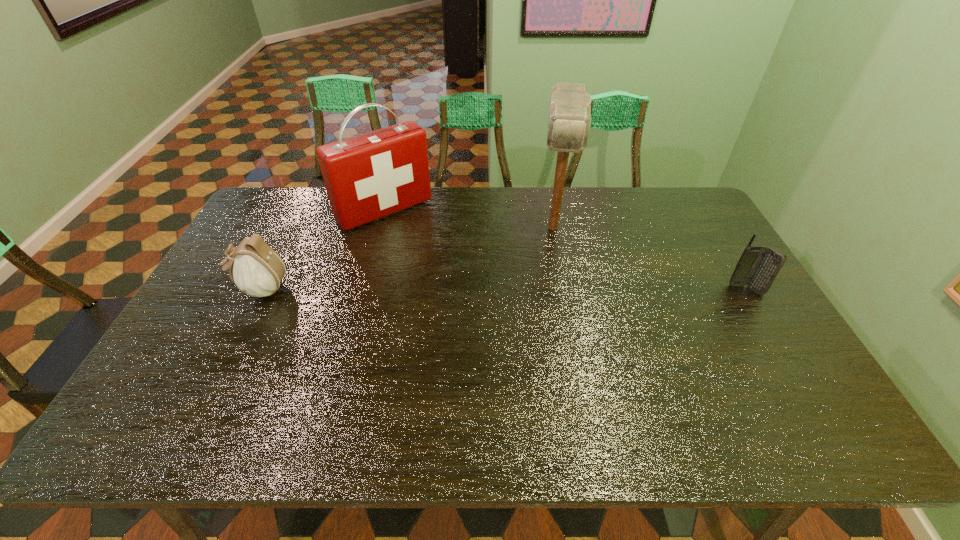
Identify the location of empty space between the first-aid kit and the cellular telephone. (565, 250).

Locate an element on the screen. The height and width of the screenshot is (540, 960). blank region between the rightmost object and the third object from left to right is located at coordinates (649, 259).

Identify which object is the third closest to the leftmost object. Please provide its 2D coordinates. Your answer should be formatted as a tuple, i.e. [(x, y)], where the tuple contains the x and y coordinates of a point satisfying the conditions above.

[(757, 267)]

Point out which object is positioned as the nearest to the rightmost object. Please provide its 2D coordinates. Your answer should be formatted as a tuple, i.e. [(x, y)], where the tuple contains the x and y coordinates of a point satisfying the conditions above.

[(569, 119)]